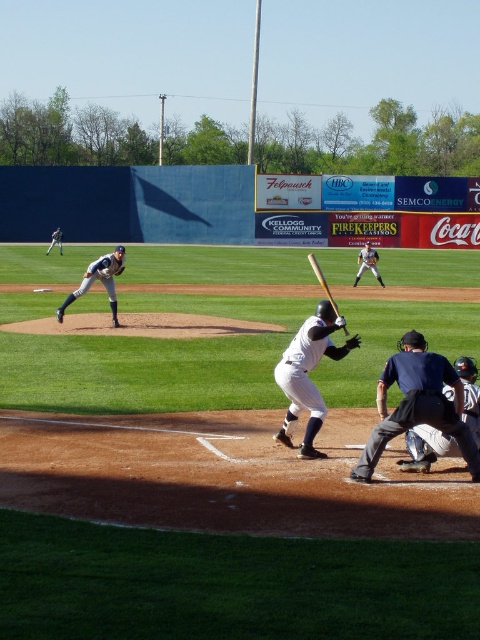
Question: Which point is closer to the camera?

Choices:
 (A) black mesh umpire at lower right
 (B) dark blue uniform at lower right
 (C) white uniformed pitcher at center
 (D) brown leather glove at lower center

Answer: (A)

Question: Which object is the farthest from the white uniformed pitcher at center?

Choices:
 (A) dark blue uniform at lower right
 (B) white uniformed pitcher at left
 (C) white matte baseball bat at center
 (D) wooden baseball bat at center

Answer: (B)

Question: Estimate the real-world distances between objects in this image. Which object is closer to the wooden baseball bat at center?

Choices:
 (A) dark blue uniform at lower right
 (B) white matte baseball bat at center
 (C) white uniformed baseball player at center

Answer: (A)

Question: Observing the image, what is the correct spatial positioning of black mesh umpire at lower right in reference to white matte baseball bat at center?

Choices:
 (A) below
 (B) above

Answer: (A)

Question: Does white uniformed pitcher at center have a greater width compared to brown leather glove at lower center?

Choices:
 (A) no
 (B) yes

Answer: (B)

Question: Does black mesh umpire at lower right appear on the left side of brown leather glove at lower center?

Choices:
 (A) no
 (B) yes

Answer: (A)